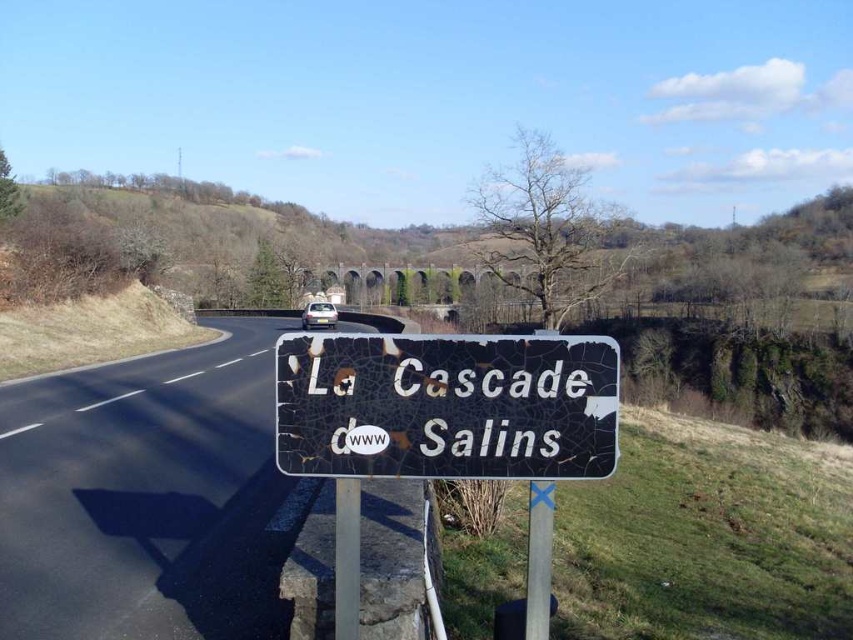
Question: Which point appears farthest from the camera in this image?

Choices:
 (A) (518, 449)
 (B) (352, 337)
 (C) (263, 372)

Answer: (C)

Question: Can you confirm if cracked paint sign at center is positioned to the left of cracked metal sign at lower center?

Choices:
 (A) yes
 (B) no

Answer: (B)

Question: Does black asphalt road at center have a smaller size compared to cracked paint sign at center?

Choices:
 (A) yes
 (B) no

Answer: (B)

Question: Which of these objects is positioned farthest from the black asphalt road at center?

Choices:
 (A) cracked metal sign at lower center
 (B) cracked paint sign at center

Answer: (A)

Question: Can you confirm if black asphalt road at center is thinner than cracked paint sign at center?

Choices:
 (A) yes
 (B) no

Answer: (B)

Question: Among these points, which one is nearest to the camera?

Choices:
 (A) (258, 476)
 (B) (398, 406)
 (C) (450, 456)

Answer: (B)